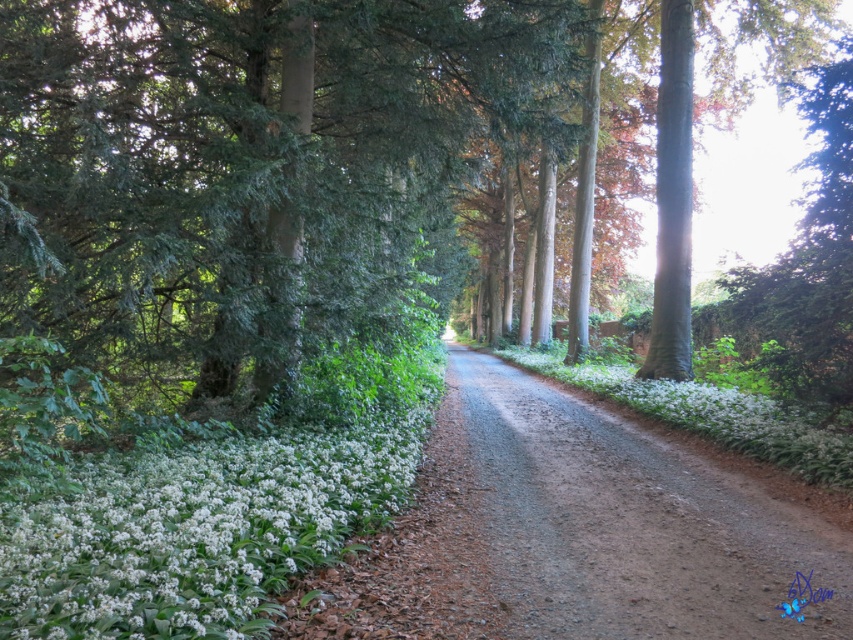
Question: Can you confirm if green textured tree at center is positioned below white matte flowers at lower left?

Choices:
 (A) no
 (B) yes

Answer: (A)

Question: Which of the following is the farthest from the observer?

Choices:
 (A) green textured tree at center
 (B) white matte flowers at lower left

Answer: (A)

Question: Among these objects, which one is nearest to the camera?

Choices:
 (A) green textured tree at center
 (B) white matte flowers at lower left

Answer: (B)

Question: Considering the relative positions of green textured tree at center and white matte flowers at lower left in the image provided, where is green textured tree at center located with respect to white matte flowers at lower left?

Choices:
 (A) below
 (B) above

Answer: (B)

Question: Is green textured tree at center closer to camera compared to white matte flowers at lower left?

Choices:
 (A) yes
 (B) no

Answer: (B)